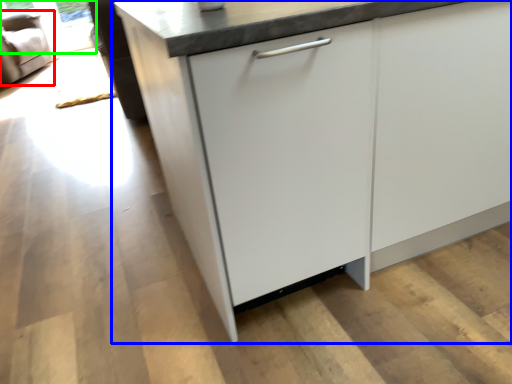
Question: Considering the real-world distances, which object is farthest from armchair (highlighted by a red box)? cabinetry (highlighted by a blue box) or window screen (highlighted by a green box)?

Choices:
 (A) cabinetry
 (B) window screen

Answer: (A)